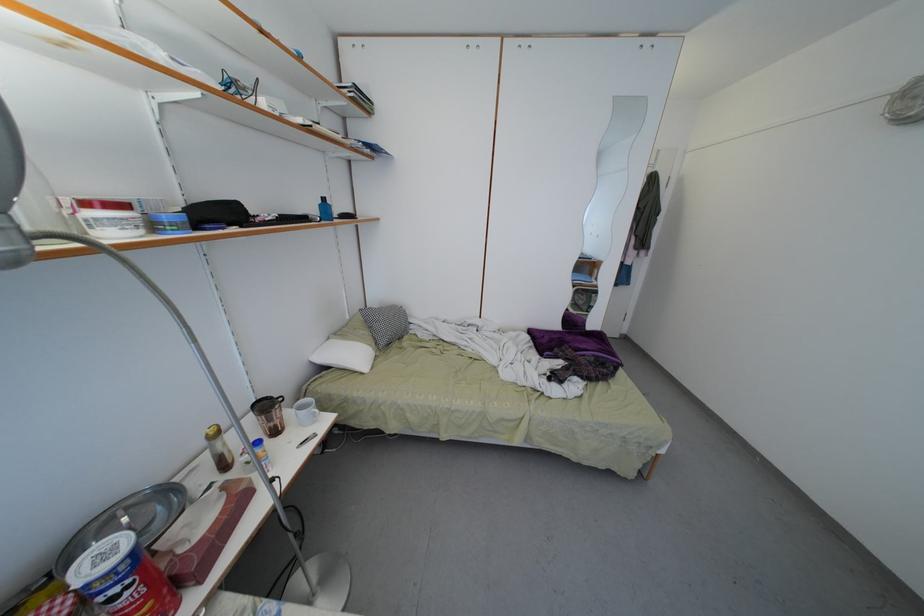
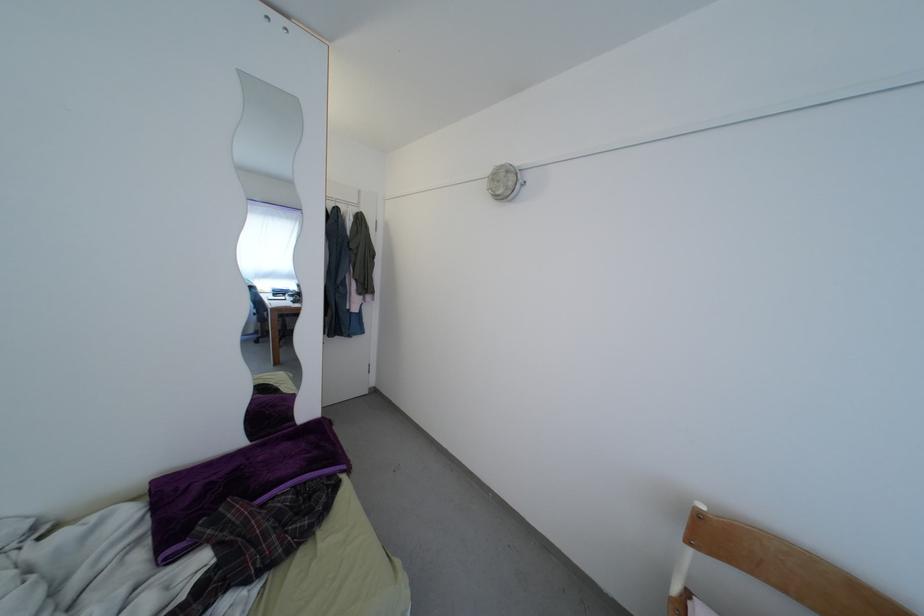
Question: Based on the continuous images, in which direction is the camera rotating? Reply with the corresponding letter.

Choices:
 (A) Left
 (B) Right
 (C) Up
 (D) Down

Answer: (B)